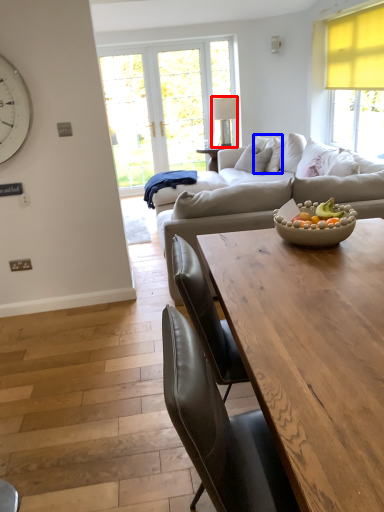
Question: Which point is closer to the camera, lamp (highlighted by a red box) or pillow (highlighted by a blue box)?

Choices:
 (A) lamp
 (B) pillow

Answer: (B)